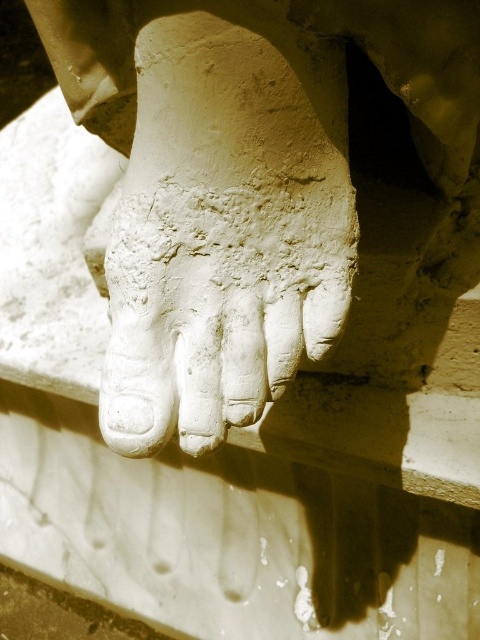
Please write a question based on the provided information without revealing the specific details in the Objects Description. The question should ask about the location of the white stone foot at center in the image. Make sure to include the object label exactly as provided in the Objects section.

The white stone foot at center is located at point (252, 186).

You are an art conservator examining a statue. You notice a point at coordinates (252,186). Based on the scene description, what object does this coordinate correspond to?

The point at coordinates (252,186) corresponds to the white stone foot at center.

You are an art conservator examining a statue. You notice both the white stone foot at center and the white stone hand at center. Which object is positioned closer to you?

The white stone foot at center is closer to the viewer than the white stone hand at center.